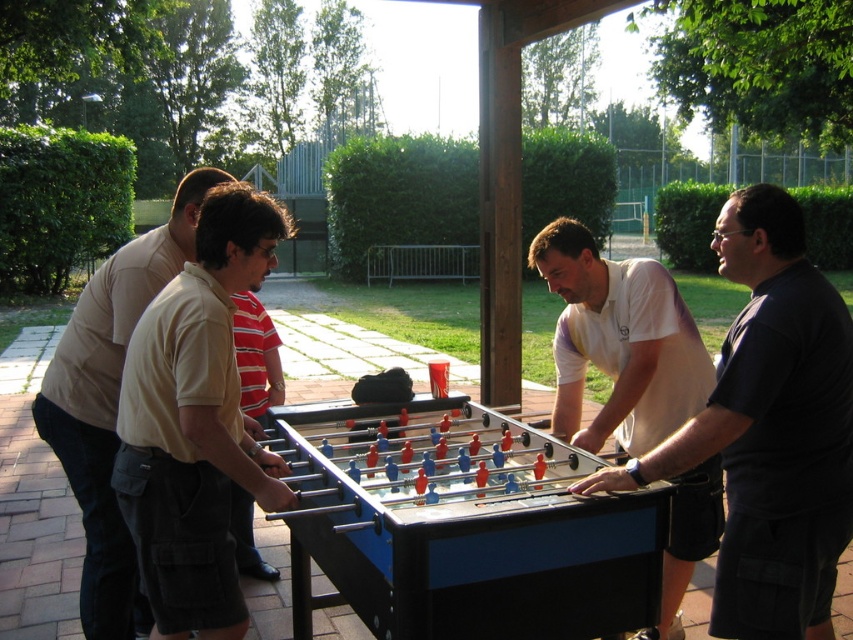
You are standing in front of the foosball table and want to place a small sticker on the table surface. The sticker needs to be placed at a point closer to you. Which point should you choose between point [798,442] and point [250,497]?

Point [798,442] is closer to the camera than point [250,497], so you should choose point [798,442] to place the sticker.